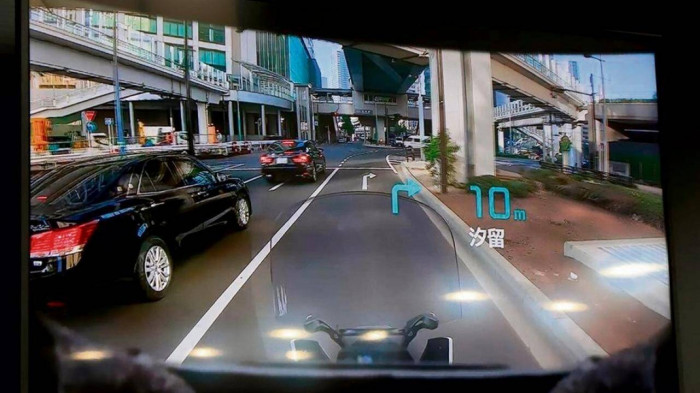
Identify the location of lights. The height and width of the screenshot is (393, 700). (183, 87), (112, 87).